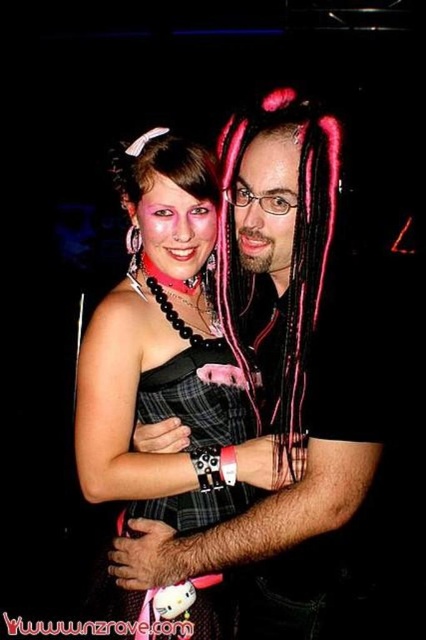
Question: Which point is closer to the camera?

Choices:
 (A) coord(216,442)
 (B) coord(100,493)
 (C) coord(267,301)

Answer: (B)

Question: Is matte black dress at center to the left of pink braided hair at center from the viewer's perspective?

Choices:
 (A) yes
 (B) no

Answer: (A)

Question: Can you confirm if matte black dress at center is positioned to the left of plaid fabric dress at center?

Choices:
 (A) yes
 (B) no

Answer: (B)

Question: Can you confirm if matte black dress at center is smaller than pink braided hair at center?

Choices:
 (A) yes
 (B) no

Answer: (B)

Question: Based on their relative distances, which object is farther from the plaid fabric dress at center?

Choices:
 (A) matte black dress at center
 (B) pink braided hair at center

Answer: (B)

Question: Considering the real-world distances, which object is farthest from the plaid fabric dress at center?

Choices:
 (A) pink braided hair at center
 (B) matte black dress at center

Answer: (A)